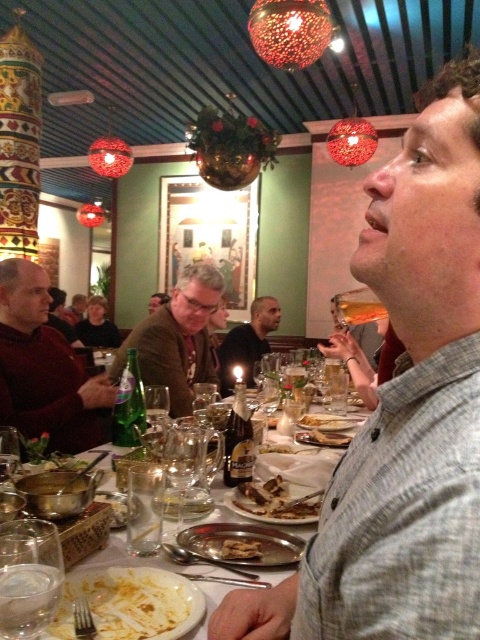
Looking at this image, you are a waiter in a restaurant. You see a dark red sweater at left and a metallic silver plate at center on the table. Which object is taller?

The dark red sweater at left is taller than the metallic silver plate at center.

You are a server in a restaurant and need to clear the table. You see the dark red sweater at left and the metallic silver plate at center. Which item is closer to you as you approach the table?

The dark red sweater at left is closer to you because the metallic silver plate at center is behind it.